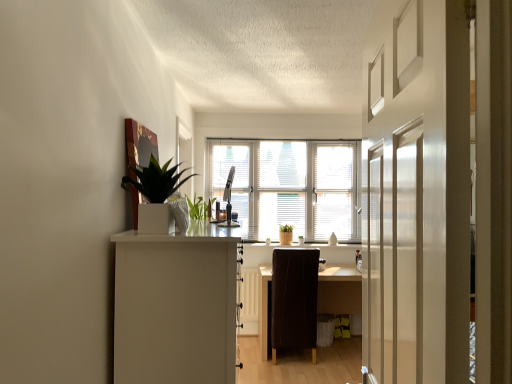
At what (x,y) coordinates should I click in order to perform the action: click on brown leather chair at center. Please return your answer as a coordinate pair (x, y). Looking at the image, I should click on (293, 300).

Measure the distance between point (x=223, y=309) and camera.

Point (x=223, y=309) is 5.52 feet away from camera.

Where is `white glossy window sill at center`? white glossy window sill at center is located at coordinates (254, 241).

This screenshot has width=512, height=384. Describe the element at coordinates (254, 241) in the screenshot. I see `white glossy window sill at center` at that location.

At what (x,y) coordinates should I click in order to perform the action: click on white blinds at center. Please return your answer as a coordinate pair (x, y). The height and width of the screenshot is (384, 512). Looking at the image, I should click on (291, 185).

This screenshot has height=384, width=512. I want to click on window above the white glossy window sill at center (from the image's perspective), so click(x=291, y=185).

Is point (228, 141) farther from camera compared to point (309, 241)?

No.

Is white blinds at center turned away from white glossy window sill at center?

No, white glossy window sill at center is not at the back of white blinds at center.

Would you say white blinds at center is outside white glossy window sill at center?

Absolutely, white blinds at center is external to white glossy window sill at center.

Which object is positioned more to the right, white blinds at center or dark brown wooden desk at center?

dark brown wooden desk at center is more to the right.

Between white blinds at center and dark brown wooden desk at center, which one has larger size?

dark brown wooden desk at center is bigger.

Consider the image. Is white blinds at center turned away from dark brown wooden desk at center?

That's not correct — white blinds at center is not looking away from dark brown wooden desk at center.

Is white blinds at center spatially inside dark brown wooden desk at center, or outside of it?

white blinds at center is located beyond the bounds of dark brown wooden desk at center.

Considering the sizes of objects white glossy planter at upper left and white matte cabinet at left in the image provided, who is shorter, white glossy planter at upper left or white matte cabinet at left?

white glossy planter at upper left is shorter.

Considering the positions of objects white glossy planter at upper left and white matte cabinet at left in the image provided, who is in front, white glossy planter at upper left or white matte cabinet at left?

white glossy planter at upper left is more forward.

Would you say white glossy planter at upper left contains white matte cabinet at left?

No, white matte cabinet at left is not a part of white glossy planter at upper left.

Which is more to the right, white matte cabinet at left or white glossy window sill at center?

white glossy window sill at center.

Considering the positions of objects white matte cabinet at left and white glossy window sill at center in the image provided, who is in front, white matte cabinet at left or white glossy window sill at center?

white matte cabinet at left is more forward.

Is white matte cabinet at left smaller than white glossy window sill at center?

No.

From a real-world perspective, who is located higher, white matte cabinet at left or white glossy window sill at center?

In real-world perspective, white glossy window sill at center is above.

Which object is wider, white glossy door at center or white glossy window sill at center?

With larger width is white glossy window sill at center.

From a real-world perspective, does white glossy door at center sit lower than white glossy window sill at center?

Actually, white glossy door at center is physically above white glossy window sill at center in the real world.

Is white glossy door at center oriented towards white glossy window sill at center?

No.

Is white glossy door at center next to white glossy window sill at center and touching it?

No, white glossy door at center is not with white glossy window sill at center.

Is white glossy window sill at center thinner than white matte cabinet at left?

Yes, white glossy window sill at center is thinner than white matte cabinet at left.

Is white glossy window sill at center smaller than white matte cabinet at left?

Yes.

The image size is (512, 384). I want to click on cabinetry below the white glossy window sill at center (from a real-world perspective), so click(176, 305).

In the scene shown: Between white glossy window sill at center and white matte cabinet at left, which one appears on the right side from the viewer's perspective?

white glossy window sill at center is more to the right.

Is white glossy door at center thinner than white glossy planter at upper left?

Indeed, white glossy door at center has a lesser width compared to white glossy planter at upper left.

Is white glossy door at center beside white glossy planter at upper left?

white glossy door at center is not next to white glossy planter at upper left, and they're not touching.

What's the angular difference between white glossy door at center and white glossy planter at upper left's facing directions?

169 degrees.

Where is `window sill in front of the white blinds at center`? window sill in front of the white blinds at center is located at coordinates (254, 241).

This screenshot has width=512, height=384. Identify the location of desk beneath the white blinds at center (from a real-world perspective). (339, 290).

Estimate the real-world distances between objects in this image. Which object is closer to white matte cabinet at left, dark brown wooden desk at center or white blinds at center?

dark brown wooden desk at center is closer to white matte cabinet at left.

Looking at the image, which one is located further to white matte cabinet at left, white glossy door at center or dark brown wooden desk at center?

Among the two, dark brown wooden desk at center is located further to white matte cabinet at left.

When comparing their distances from brown leather chair at center, does white blinds at center or white glossy door at center seem closer?

white blinds at center is positioned closer to the anchor brown leather chair at center.

Based on their spatial positions, is white glossy window sill at center or dark brown wooden desk at center further from white blinds at center?

dark brown wooden desk at center is positioned further to the anchor white blinds at center.

From the image, which object appears to be farther from white glossy window sill at center, white blinds at center or white glossy planter at upper left?

The object further to white glossy window sill at center is white glossy planter at upper left.

From the image, which object appears to be nearer to white blinds at center, white glossy planter at upper left or white glossy window sill at center?

white glossy window sill at center lies closer to white blinds at center than the other object.

When comparing their distances from white glossy door at center, does white glossy planter at upper left or white glossy window sill at center seem further?

Based on the image, white glossy window sill at center appears to be further to white glossy door at center.

When comparing their distances from white blinds at center, does white glossy door at center or white glossy planter at upper left seem closer?

white glossy planter at upper left.

Find the location of a particular element. The height and width of the screenshot is (384, 512). window sill between white matte cabinet at left and white blinds at center from front to back is located at coordinates (254, 241).

Locate an element on the screen. desk between white glossy door at center and white glossy window sill at center along the z-axis is located at coordinates (339, 290).

Where is `desk between white matte cabinet at left and white blinds at center in the front-back direction`? The image size is (512, 384). desk between white matte cabinet at left and white blinds at center in the front-back direction is located at coordinates (339, 290).

In order to click on houseplant between white glossy door at center and white blinds at center in the front-back direction in this screenshot , I will do `click(156, 180)`.